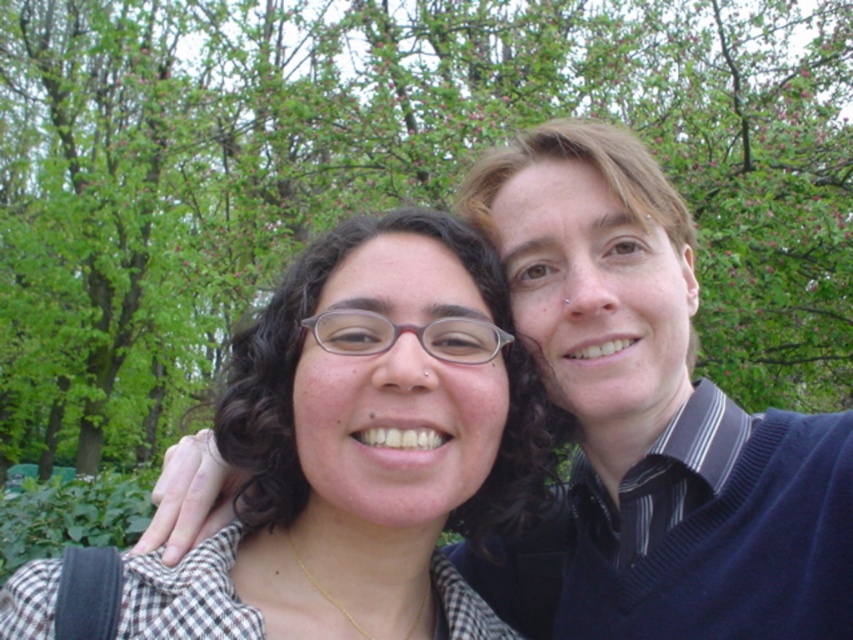
Question: Which point appears farthest from the camera in this image?

Choices:
 (A) (576, 499)
 (B) (486, 394)

Answer: (A)

Question: Does matte checkered shirt at center appear on the left side of blue sweater at upper right?

Choices:
 (A) no
 (B) yes

Answer: (B)

Question: Which of the following is the farthest from the observer?

Choices:
 (A) (625, 595)
 (B) (503, 413)

Answer: (A)

Question: Which of the following is the farthest from the observer?

Choices:
 (A) blue sweater at upper right
 (B) matte checkered shirt at center

Answer: (A)

Question: Does matte checkered shirt at center come in front of blue sweater at upper right?

Choices:
 (A) yes
 (B) no

Answer: (A)

Question: Does matte checkered shirt at center appear on the right side of blue sweater at upper right?

Choices:
 (A) no
 (B) yes

Answer: (A)